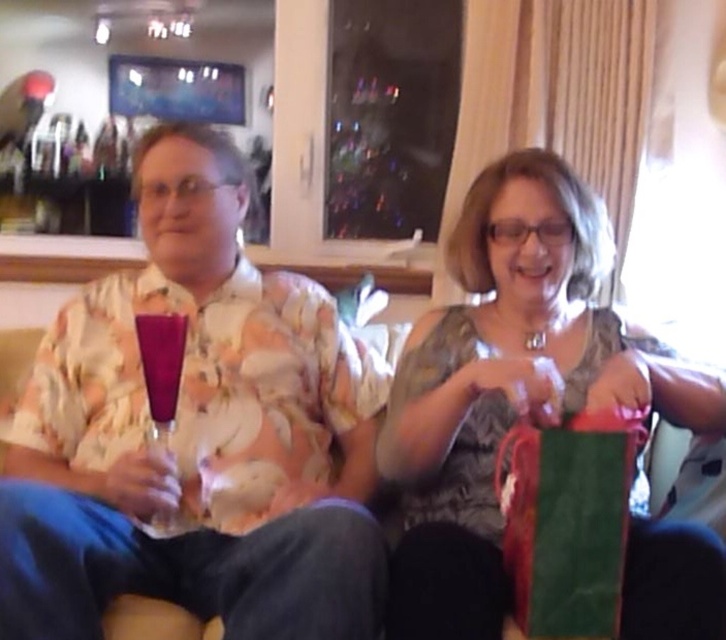
You are standing in the living room and want to hand a book to the person wearing the floral shirt at left. The book is 12 inches long. Can you reach them without moving closer?

The floral shirt at left is 35.63 inches from the viewer. Since the book is 12 inches long, you can extend your arm to reach them comfortably without needing to move closer.

You are organizing a party and need to choose a container to hold snacks. You have the green paper bag at center and the matte purple glass at center available. Which one has a bigger capacity?

The green paper bag at center is larger in size than the matte purple glass at center, so it has a bigger capacity.

Looking at this image, you are at a holiday party and need to pour a drink into the taller glass. Which one should you choose between the transparent glass wine glass at center and the matte purple glass at center?

The transparent glass wine glass at center is taller than the matte purple glass at center, so you should choose the transparent glass wine glass at center to pour the drink.